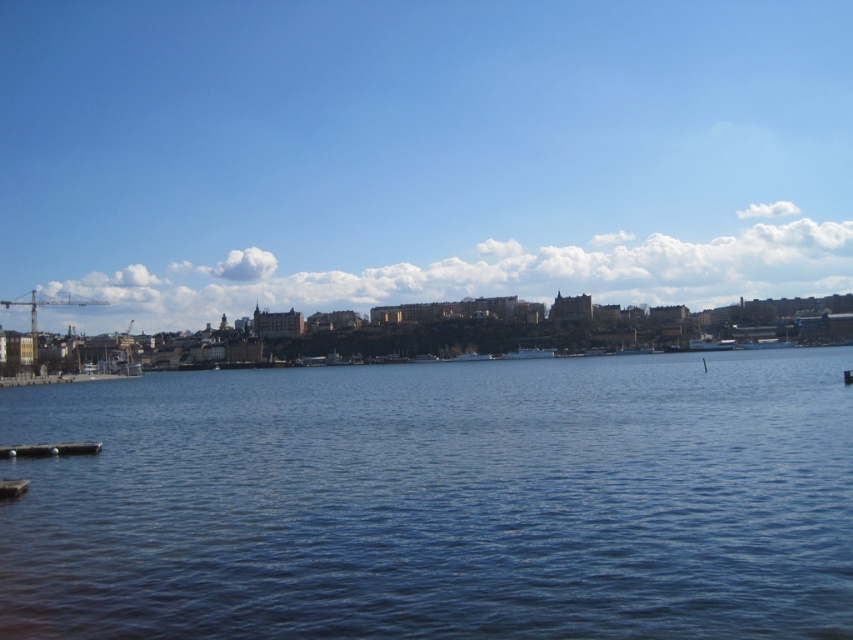
Consider the image. You are standing on the smooth wooden dock at lower left and want to walk to the brown wooden dock at lower left. Which direction should you move to reach it?

The smooth wooden dock at lower left is located below the brown wooden dock at lower left, so you should move upward to reach the brown wooden dock at lower left.

You are standing at the waterfront and want to take a photo of the two points in the scene. Which point, point [114,397] or point [85,444], is closer to your camera when taking the photo?

Point [85,444] is closer to the camera because it is less further than point [114,397].